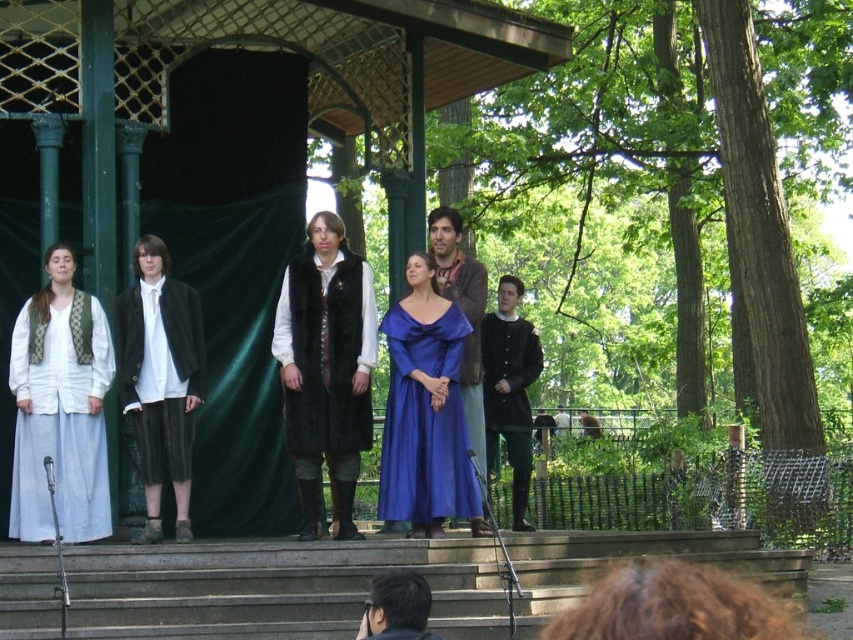
You are an audience member sitting in the front row of the outdoor stage. You notice two elements in the scene that are both black in color. The velvet black vest at center and the smooth black hair at lower center. Which one is positioned higher up in the image?

The velvet black vest at center is located above smooth black hair at lower center, so the velvet black vest at center is positioned higher up in the image.

You are an actor positioned at the center of the stage and need to move to the white woven fabric dress at left. Which direction should you move to reach it?

The white woven fabric dress at left is located at point (x=61, y=408), so you should move to the left side of the stage to reach it.